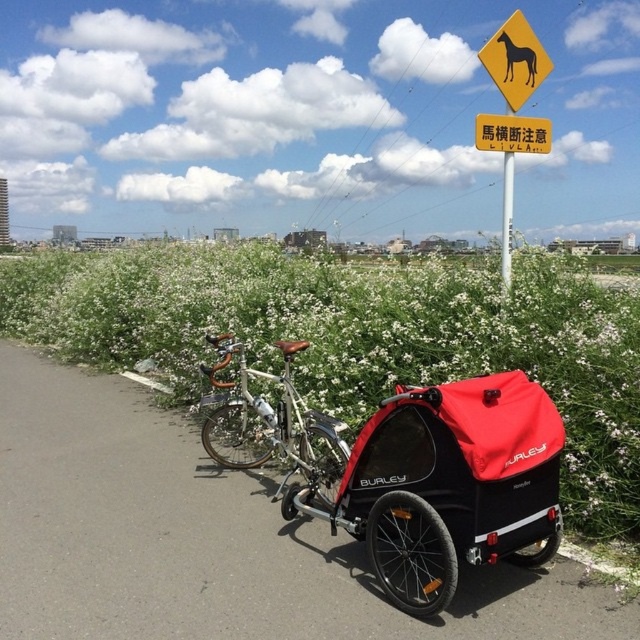
Question: Does yellow plastic horse at upper right have a greater width compared to black plastic horse at upper center?

Choices:
 (A) yes
 (B) no

Answer: (B)

Question: Which object is the farthest from the yellow plastic horse at upper right?

Choices:
 (A) black matte bicycle at center
 (B) white plastic pole at center
 (C) black plastic horse at upper center
 (D) red matte baby carriage at lower right

Answer: (A)

Question: Observing the image, what is the correct spatial positioning of black matte bicycle at center in reference to yellow plastic horse at upper center?

Choices:
 (A) right
 (B) left

Answer: (B)

Question: Which object is positioned farthest from the red matte baby carriage at lower right?

Choices:
 (A) silver metallic bicycle at center
 (B) yellow plastic horse at upper center
 (C) yellow plastic horse at upper right
 (D) black plastic horse at upper center

Answer: (D)

Question: Which object appears closest to the camera in this image?

Choices:
 (A) red matte baby carriage at lower right
 (B) silver metallic bicycle at center
 (C) yellow plastic horse at upper center

Answer: (A)

Question: Is black matte bicycle at center wider than red matte baby carriage at lower right?

Choices:
 (A) yes
 (B) no

Answer: (A)